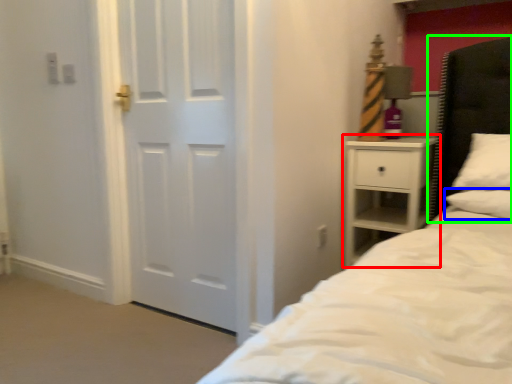
Question: Which object is positioned closest to nightstand (highlighted by a red box)? Select from pillow (highlighted by a blue box) and headboard (highlighted by a green box).

Choices:
 (A) pillow
 (B) headboard

Answer: (B)